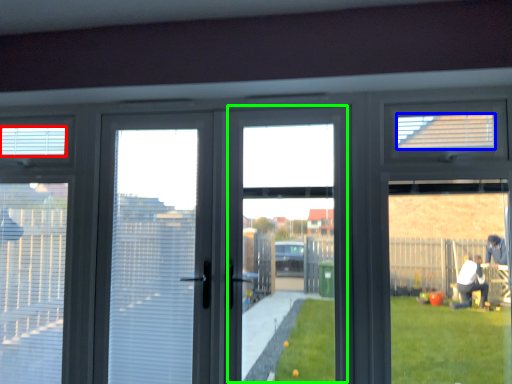
Question: Estimate the real-world distances between objects in this image. Which object is closer to blind (highlighted by a red box), blind (highlighted by a blue box) or window screen (highlighted by a green box)?

Choices:
 (A) blind
 (B) window screen

Answer: (B)